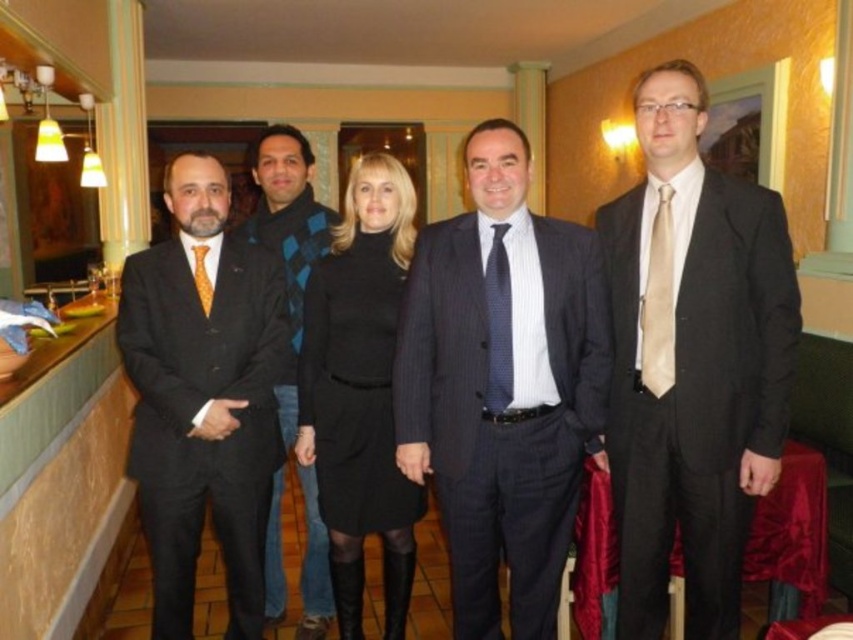
Question: Among these points, which one is nearest to the camera?

Choices:
 (A) pos(509,321)
 (B) pos(666,250)

Answer: (B)

Question: Among these points, which one is nearest to the camera?

Choices:
 (A) (648, 336)
 (B) (494, 260)
 (C) (657, 310)

Answer: (C)

Question: Which object appears closest to the camera in this image?

Choices:
 (A) matte black jacket at center
 (B) matte black suit at right
 (C) orange silk tie at left
 (D) dark gray pinstripe suit at center

Answer: (B)

Question: Can you confirm if dark gray pinstripe suit at center is smaller than dark blue textured tie at center?

Choices:
 (A) yes
 (B) no

Answer: (B)

Question: Is black wool dress at center to the right of beige silk tie at right from the viewer's perspective?

Choices:
 (A) yes
 (B) no

Answer: (B)

Question: Does dark gray pinstripe suit at center appear on the left side of orange silk tie at left?

Choices:
 (A) no
 (B) yes

Answer: (A)